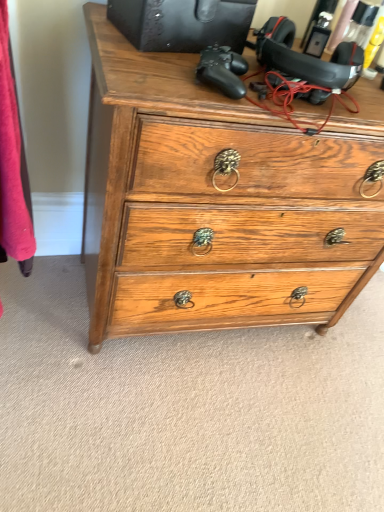
Locate an element on the screen. The width and height of the screenshot is (384, 512). wooden chest of drawers at center is located at coordinates point(220,201).

The width and height of the screenshot is (384, 512). Describe the element at coordinates (220, 201) in the screenshot. I see `wooden chest of drawers at center` at that location.

This screenshot has width=384, height=512. Identify the location of wooden chest of drawers at center. (220, 201).